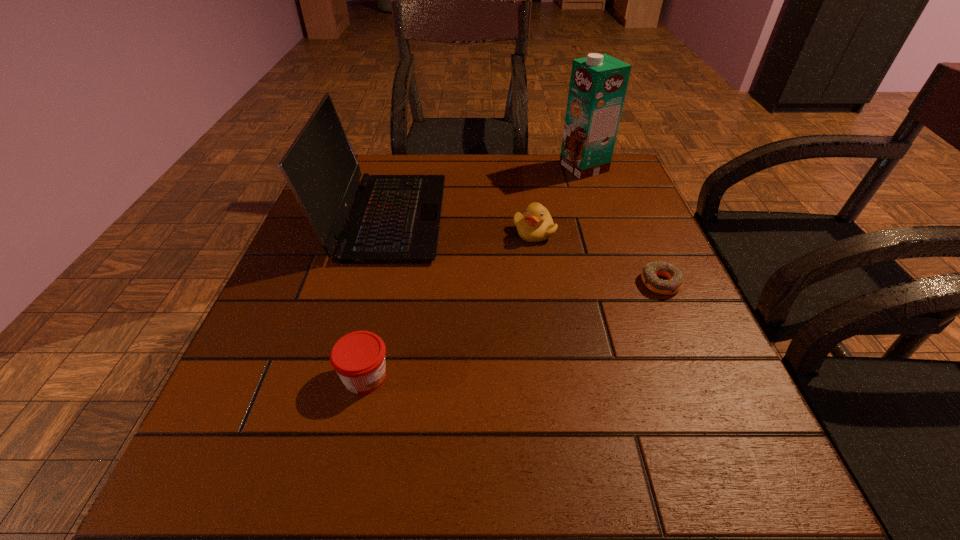
You are a GUI agent. You are given a task and a screenshot of the screen. Output one action in this format:
    pyautogui.click(x=<x>, y=<y>)
    Task: Click on the vacant space at the left edge of the desktop
    The height and width of the screenshot is (540, 960).
    Given the screenshot: What is the action you would take?
    pyautogui.click(x=341, y=288)

At what (x,y) coordinates should I click in order to perform the action: click on free space at the right edge. Please return your answer as a coordinate pair (x, y). This screenshot has height=540, width=960. Looking at the image, I should click on (708, 354).

The image size is (960, 540). Find the location of `free space at the near right corner of the desktop`. free space at the near right corner of the desktop is located at coordinates (734, 472).

This screenshot has height=540, width=960. I want to click on blank region between the laptop computer and the tallest object, so click(485, 193).

Find the location of `empty space that is in between the laptop computer and the jam`. empty space that is in between the laptop computer and the jam is located at coordinates (375, 297).

Identify the location of free space between the laptop computer and the carton. Image resolution: width=960 pixels, height=540 pixels. (485, 193).

Find the location of `free area in between the second nearest object and the nearest object`. free area in between the second nearest object and the nearest object is located at coordinates (513, 330).

This screenshot has height=540, width=960. What are the coordinates of `free area in between the laptop computer and the carton` in the screenshot? It's located at point(485,193).

The height and width of the screenshot is (540, 960). What are the coordinates of `unoccupied area between the second nearest object and the laptop computer` in the screenshot? It's located at (523, 251).

At what (x,y) coordinates should I click in order to perform the action: click on free space between the second tallest object and the third object from right to left. Please return your answer as a coordinate pair (x, y). This screenshot has height=540, width=960. Looking at the image, I should click on (460, 225).